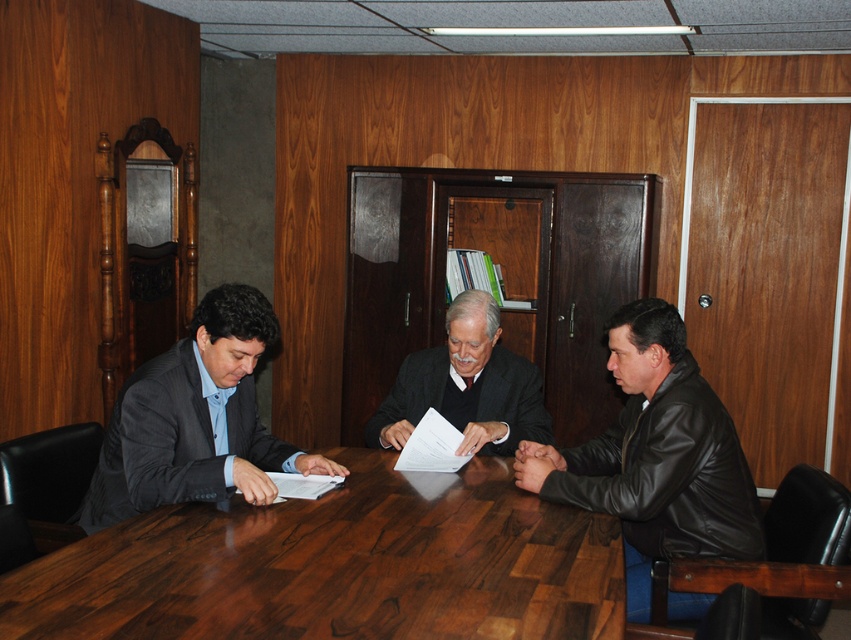
You are organizing a charity event and need to decide which suit to wear. You have a matte gray suit at left and a dark gray suit at center. Which one would you choose if you want to make a bold statement with a larger silhouette?

The matte gray suit at left is larger in size than the dark gray suit at center, so choosing the matte gray suit at left would create a bolder statement with a larger silhouette.

You are standing in the conference room and need to reach both the point at coordinates point (95, 580) and point (737, 513). Which point should you approach first to minimize the distance walked?

You should approach point (95, 580) first because it is closer to you than point (737, 513), so reaching it first requires less walking distance.